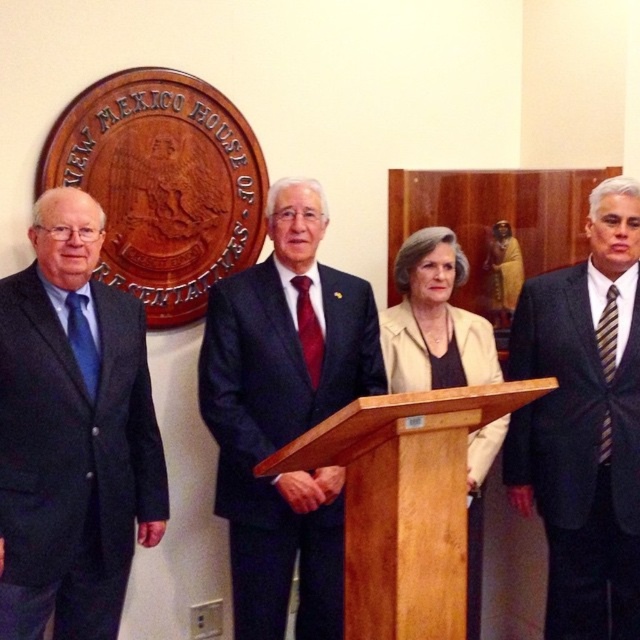
Who is more forward, (260, 449) or (362, 600)?

Point (362, 600) is in front.

Does point (317, 637) lie in front of point (445, 400)?

No, (317, 637) is further to viewer.

Between point (356, 296) and point (406, 449), which one is positioned behind?

Positioned behind is point (356, 296).

Find the location of a particular element. This screenshot has height=640, width=640. dark blue suit at center is located at coordinates (284, 413).

Describe the element at coordinates (284, 413) in the screenshot. This screenshot has height=640, width=640. I see `dark blue suit at center` at that location.

In order to click on dark blue suit at center in this screenshot , I will do `click(284, 413)`.

Is point (352, 589) in front of point (493, 454)?

Yes, it is.

Does wooden podium at center have a lesser height compared to beige fabric jacket at center?

Yes, wooden podium at center is shorter than beige fabric jacket at center.

Is point (420, 632) farther from camera compared to point (486, 433)?

No, it is not.

I want to click on wooden podium at center, so click(404, 502).